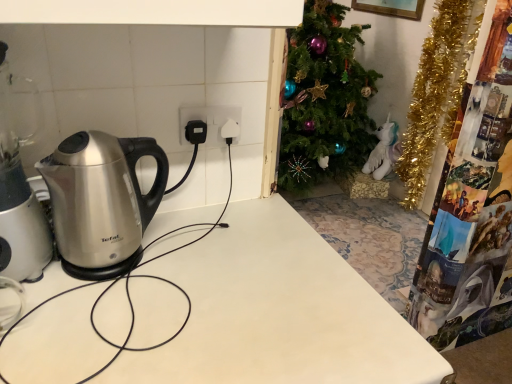
Question: Is satin silver kettle at left positioned in front of white glossy table at center?

Choices:
 (A) yes
 (B) no

Answer: (B)

Question: From the image's perspective, would you say satin silver kettle at left is positioned over white glossy table at center?

Choices:
 (A) no
 (B) yes

Answer: (B)

Question: From a real-world perspective, does satin silver kettle at left stand above white glossy table at center?

Choices:
 (A) yes
 (B) no

Answer: (A)

Question: From the image's perspective, is satin silver kettle at left under white glossy table at center?

Choices:
 (A) no
 (B) yes

Answer: (A)

Question: Can you confirm if satin silver kettle at left is taller than white glossy table at center?

Choices:
 (A) no
 (B) yes

Answer: (B)

Question: Is satin silver kettle at left to the right of white glossy table at center from the viewer's perspective?

Choices:
 (A) no
 (B) yes

Answer: (A)

Question: From a real-world perspective, is white glossy table at center located higher than white plastic socket at center?

Choices:
 (A) yes
 (B) no

Answer: (B)

Question: Is white glossy table at center bigger than white plastic socket at center?

Choices:
 (A) no
 (B) yes

Answer: (B)

Question: Can you see white glossy table at center touching white plastic socket at center?

Choices:
 (A) no
 (B) yes

Answer: (A)

Question: Can you confirm if white glossy table at center is taller than white plastic socket at center?

Choices:
 (A) yes
 (B) no

Answer: (A)

Question: Can you confirm if white glossy table at center is smaller than white plastic socket at center?

Choices:
 (A) no
 (B) yes

Answer: (A)

Question: Considering the relative positions of white glossy table at center and white plastic socket at center in the image provided, is white glossy table at center to the left of white plastic socket at center from the viewer's perspective?

Choices:
 (A) yes
 (B) no

Answer: (A)

Question: Is satin silver kettle at left aimed at white plastic socket at center?

Choices:
 (A) yes
 (B) no

Answer: (B)